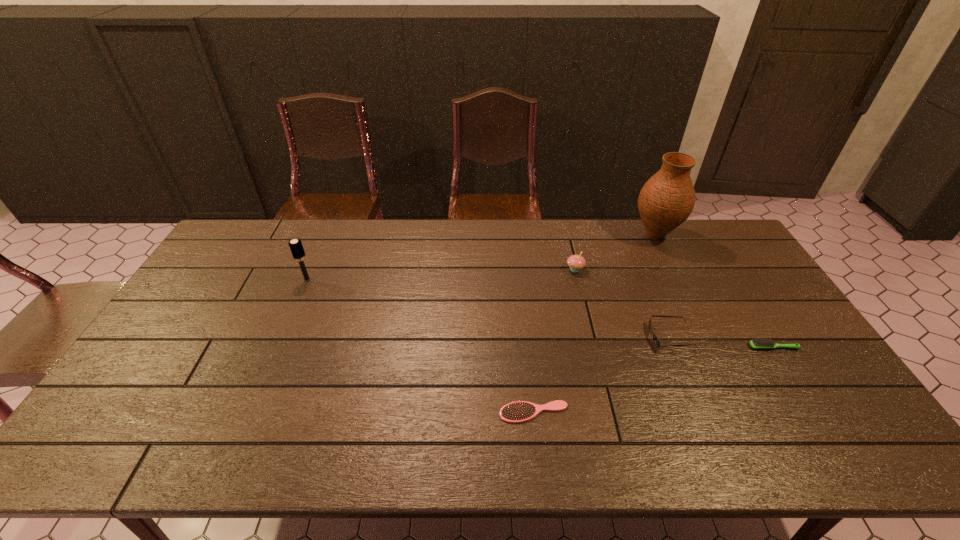
Identify the location of free space in the image that satisfies the following two spatial constraints: 1. on the back side of the second tallest object; 2. on the left side of the cupcake. (312, 269).

Image resolution: width=960 pixels, height=540 pixels. I want to click on free region that satisfies the following two spatial constraints: 1. on the back side of the second object from left to right; 2. on the left side of the farthest object, so click(x=516, y=236).

I want to click on vacant space that satisfies the following two spatial constraints: 1. on the back side of the cupcake; 2. on the right side of the nearest object, so click(x=519, y=269).

Find the location of a particular element. This screenshot has height=540, width=960. vacant point that satisfies the following two spatial constraints: 1. on the lenses of the second farthest hairbrush; 2. on the left side of the fourth tallest object is located at coordinates (675, 347).

This screenshot has width=960, height=540. Find the location of `vacant position in the image that satisfies the following two spatial constraints: 1. on the front side of the leftmost object; 2. on the left side of the second nearest hairbrush`. vacant position in the image that satisfies the following two spatial constraints: 1. on the front side of the leftmost object; 2. on the left side of the second nearest hairbrush is located at coordinates (278, 347).